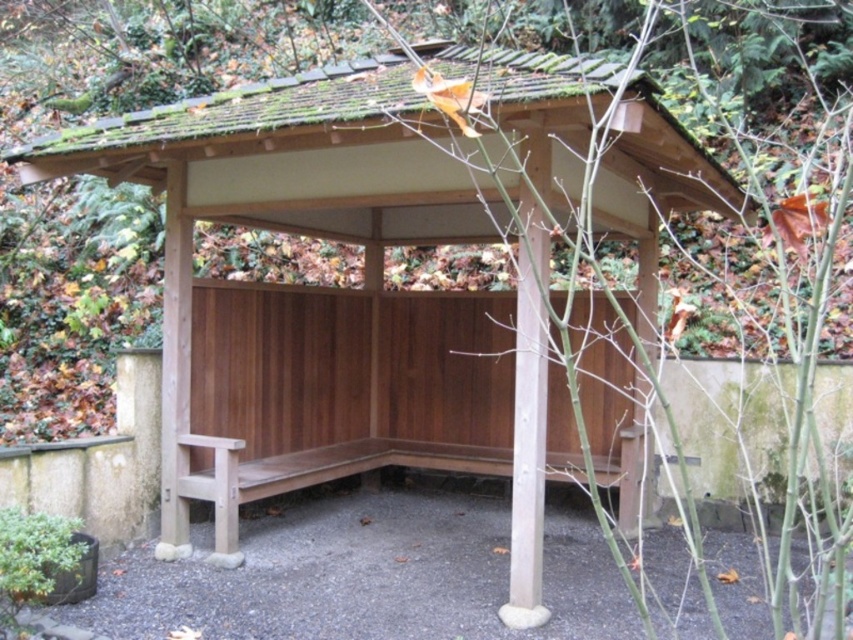
You are planning to place a 6.5 feet long picnic blanket between the wooden bench at center and the wooden bench at lower left. Will there be enough space for the blanket to fit between them?

The distance between the wooden bench at center and the wooden bench at lower left is 7.16 feet, which is greater than the 6.5 feet length of the picnic blanket. Therefore, the blanket will fit comfortably between them.

You are a visitor at the shelter and want to sit on the tallest bench available. Which bench should you choose between the wooden bench at center and the wooden bench at lower left?

The wooden bench at center is taller than the wooden bench at lower left, so you should choose the wooden bench at center.

You are planning to host a small gathering in the wooden shelter and need to seat 4 people. The wooden bench at center and wooden bench at lower left are available. Which bench can accommodate more people?

The wooden bench at center has a larger size compared to wooden bench at lower left, so it can accommodate more people.